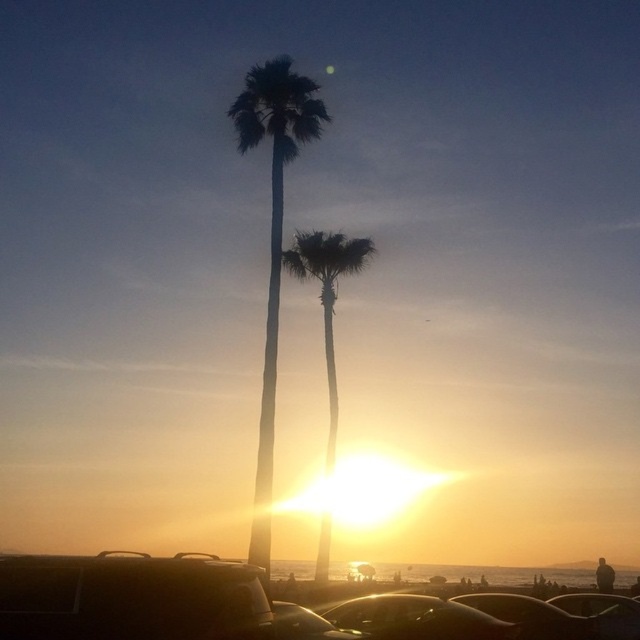
Question: Can you confirm if silhouette palm tree at center is positioned to the left of glossy metallic car at center?

Choices:
 (A) yes
 (B) no

Answer: (A)

Question: Which point appears closest to the camera in this image?

Choices:
 (A) (317, 237)
 (B) (240, 108)

Answer: (B)

Question: Is glossy metallic car at center wider than shiny metallic car at lower center?

Choices:
 (A) no
 (B) yes

Answer: (B)

Question: Estimate the real-world distances between objects in this image. Which object is closer to the glossy metallic car at center?

Choices:
 (A) metallic silver car at lower center
 (B) silhouette palm tree at center
 (C) shiny metallic car at lower center

Answer: (A)

Question: Can you confirm if matte black car at lower left is bigger than glossy metallic car at center?

Choices:
 (A) no
 (B) yes

Answer: (B)

Question: Among these objects, which one is farthest from the camera?

Choices:
 (A) metallic silver car at lower center
 (B) silhouette palm tree at center
 (C) shiny metallic car at lower center
 (D) glossy metallic car at center

Answer: (B)